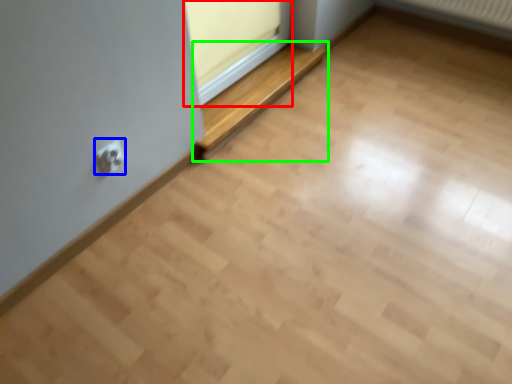
Question: Considering the real-world distances, which object is farthest from window frame (highlighted by a red box)? electric outlet (highlighted by a blue box) or balustrade (highlighted by a green box)?

Choices:
 (A) electric outlet
 (B) balustrade

Answer: (A)